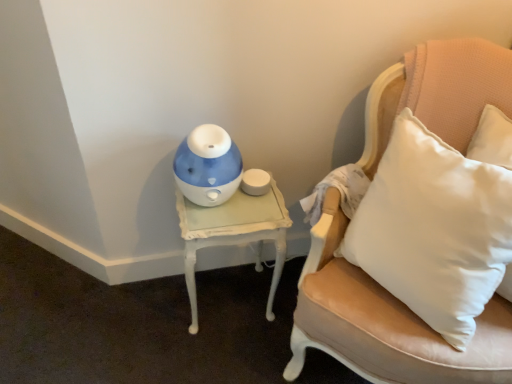
Question: Would you say blue glossy humidifier at center is a long distance from white painted wood table at left?

Choices:
 (A) yes
 (B) no

Answer: (B)

Question: Considering the relative sizes of blue glossy humidifier at center and white painted wood table at left in the image provided, is blue glossy humidifier at center bigger than white painted wood table at left?

Choices:
 (A) no
 (B) yes

Answer: (A)

Question: Considering the relative sizes of blue glossy humidifier at center and white painted wood table at left in the image provided, is blue glossy humidifier at center taller than white painted wood table at left?

Choices:
 (A) yes
 (B) no

Answer: (B)

Question: From the image's perspective, is blue glossy humidifier at center located above white painted wood table at left?

Choices:
 (A) no
 (B) yes

Answer: (B)

Question: Is blue glossy humidifier at center next to white painted wood table at left and touching it?

Choices:
 (A) yes
 (B) no

Answer: (B)

Question: Considering the relative positions of leather cushion at right and white painted wood table at left in the image provided, is leather cushion at right to the left or to the right of white painted wood table at left?

Choices:
 (A) left
 (B) right

Answer: (B)

Question: Is leather cushion at right taller or shorter than white painted wood table at left?

Choices:
 (A) short
 (B) tall

Answer: (B)

Question: In terms of size, does leather cushion at right appear bigger or smaller than white painted wood table at left?

Choices:
 (A) small
 (B) big

Answer: (B)

Question: In terms of width, does leather cushion at right look wider or thinner when compared to white painted wood table at left?

Choices:
 (A) thin
 (B) wide

Answer: (B)

Question: Based on their sizes in the image, would you say white painted wood table at left is bigger or smaller than leather cushion at right?

Choices:
 (A) big
 (B) small

Answer: (B)

Question: Considering the relative positions of white painted wood table at left and leather cushion at right in the image provided, is white painted wood table at left to the left or to the right of leather cushion at right?

Choices:
 (A) right
 (B) left

Answer: (B)

Question: Does point [281, 210] appear closer or farther from the camera than point [290, 337]?

Choices:
 (A) farther
 (B) closer

Answer: (B)

Question: From a real-world perspective, is white painted wood table at left above or below leather cushion at right?

Choices:
 (A) below
 (B) above

Answer: (A)

Question: Is leather cushion at right wider or thinner than blue glossy humidifier at center?

Choices:
 (A) thin
 (B) wide

Answer: (B)

Question: Considering their positions, is leather cushion at right located in front of or behind blue glossy humidifier at center?

Choices:
 (A) behind
 (B) front

Answer: (B)